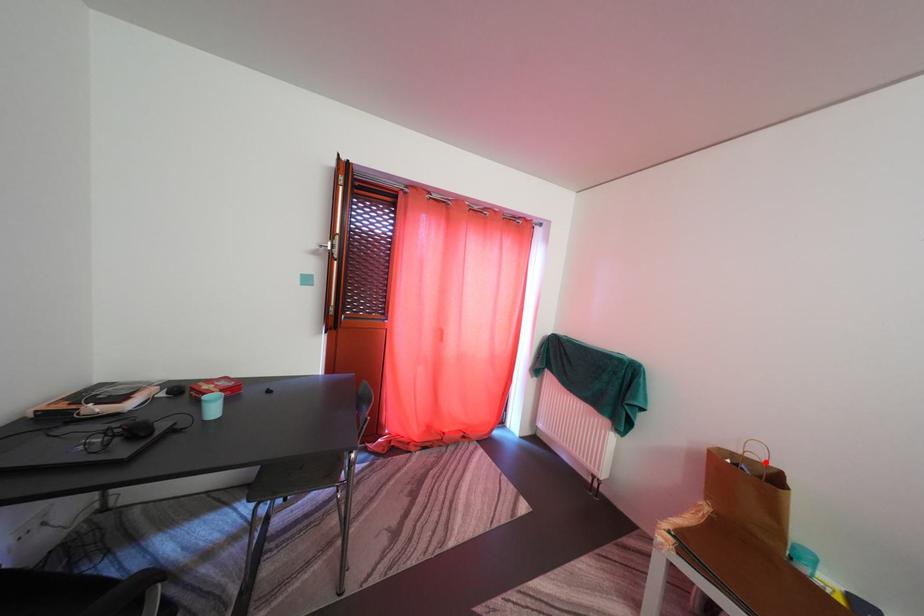
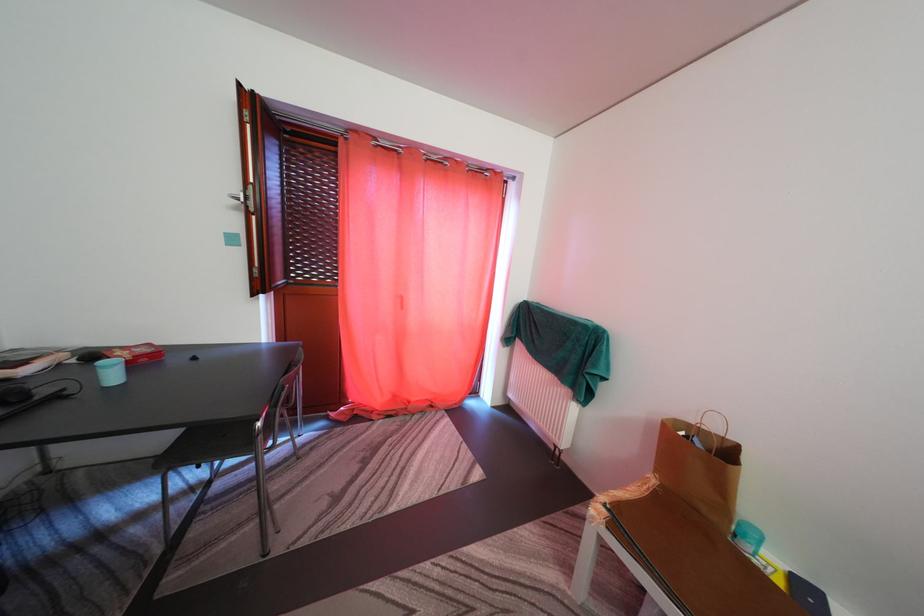
In the second image, find the point that corresponds to the highlighted location in the first image.

(723, 435)